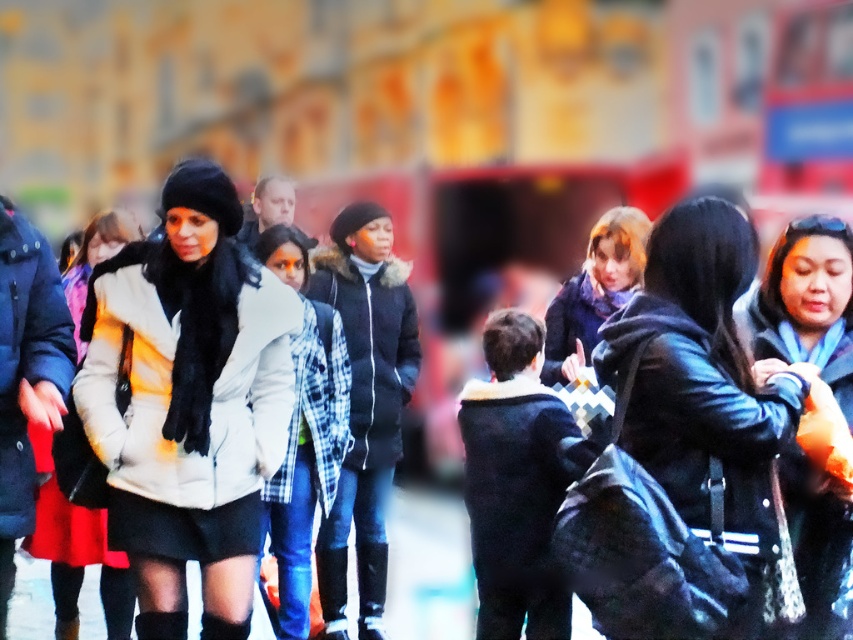
Who is more forward, (782, 300) or (361, 602)?

Point (782, 300) is in front.

Does leather jacket at right appear on the left side of black leather boot at lower center?

No, leather jacket at right is not to the left of black leather boot at lower center.

This screenshot has width=853, height=640. Identify the location of leather jacket at right. (805, 304).

This screenshot has height=640, width=853. In order to click on leather jacket at right in this screenshot , I will do `click(805, 304)`.

Who is positioned more to the left, smooth concrete pavement at lower center or white matte jacket at center?

Positioned to the left is white matte jacket at center.

Measure the distance from smooth concrete pavement at lower center to white matte jacket at center.

A distance of 3.25 meters exists between smooth concrete pavement at lower center and white matte jacket at center.

The image size is (853, 640). Identify the location of smooth concrete pavement at lower center. (428, 566).

Who is positioned more to the left, white fur coat at center or smooth concrete pavement at lower center?

From the viewer's perspective, white fur coat at center appears more on the left side.

Measure the distance from white fur coat at center to smooth concrete pavement at lower center.

They are 5.19 meters apart.

Is point (181, 481) closer to viewer compared to point (422, 596)?

That is True.

You are a GUI agent. You are given a task and a screenshot of the screen. Output one action in this format:
    pyautogui.click(x=<x>, y=<y>)
    Task: Click on the white fur coat at center
    The width and height of the screenshot is (853, 640).
    Given the screenshot: What is the action you would take?
    pyautogui.click(x=189, y=403)